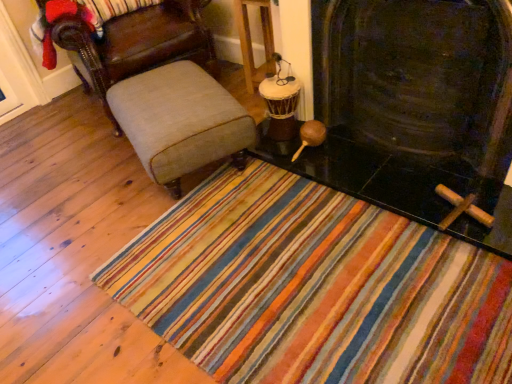
Question: Is beige fabric ottoman at center thinner than wooden drum at center?

Choices:
 (A) no
 (B) yes

Answer: (A)

Question: Are beige fabric ottoman at center and wooden drum at center making contact?

Choices:
 (A) yes
 (B) no

Answer: (B)

Question: Considering the relative sizes of beige fabric ottoman at center and wooden drum at center in the image provided, is beige fabric ottoman at center shorter than wooden drum at center?

Choices:
 (A) no
 (B) yes

Answer: (B)

Question: From the image's perspective, is beige fabric ottoman at center above wooden drum at center?

Choices:
 (A) yes
 (B) no

Answer: (B)

Question: Is beige fabric ottoman at center facing away from wooden drum at center?

Choices:
 (A) no
 (B) yes

Answer: (A)

Question: From a real-world perspective, is beige fabric ottoman at center under wooden drum at center?

Choices:
 (A) no
 (B) yes

Answer: (B)

Question: Is black stone fireplace at center oriented away from wooden drum at center?

Choices:
 (A) yes
 (B) no

Answer: (B)

Question: Considering the relative sizes of black stone fireplace at center and wooden drum at center in the image provided, is black stone fireplace at center taller than wooden drum at center?

Choices:
 (A) no
 (B) yes

Answer: (B)

Question: Is black stone fireplace at center not within wooden drum at center?

Choices:
 (A) no
 (B) yes

Answer: (B)

Question: From a real-world perspective, does black stone fireplace at center stand above wooden drum at center?

Choices:
 (A) no
 (B) yes

Answer: (B)

Question: Considering the relative positions of black stone fireplace at center and wooden drum at center in the image provided, is black stone fireplace at center to the right of wooden drum at center from the viewer's perspective?

Choices:
 (A) no
 (B) yes

Answer: (B)

Question: Can you confirm if black stone fireplace at center is bigger than wooden drum at center?

Choices:
 (A) yes
 (B) no

Answer: (A)

Question: Does light beige fabric chair at left come behind black stone fireplace at center?

Choices:
 (A) no
 (B) yes

Answer: (B)